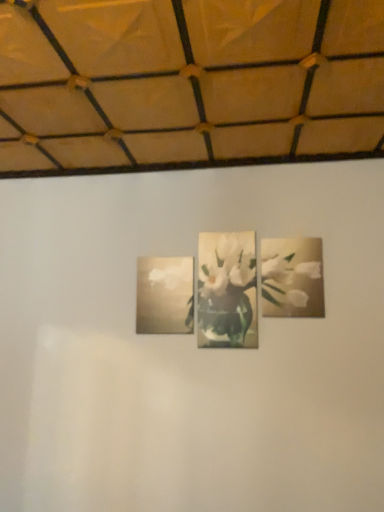
Locate an element on the screen. matte gold picture frame at center is located at coordinates (165, 295).

Describe the element at coordinates (165, 295) in the screenshot. I see `matte gold picture frame at center` at that location.

Image resolution: width=384 pixels, height=512 pixels. What are the coordinates of `white glossy flower at upper right` in the screenshot? It's located at (290, 281).

This screenshot has width=384, height=512. What do you see at coordinates (290, 281) in the screenshot?
I see `white glossy flower at upper right` at bounding box center [290, 281].

Locate an element on the screen. This screenshot has width=384, height=512. matte gold picture frame at center is located at coordinates (165, 295).

From the picture: Is matte gold picture frame at center to the left or to the right of white glossy flower at upper right in the image?

matte gold picture frame at center is positioned on white glossy flower at upper right's left side.

Looking at this image, is matte gold picture frame at center positioned before white glossy flower at upper right?

No.

Which is in front, point (188, 269) or point (271, 260)?

The point (271, 260) is in front.

From the image's perspective, is matte gold picture frame at center above or below white glossy flower at upper right?

Clearly, from the image's perspective, matte gold picture frame at center is below white glossy flower at upper right.

From a real-world perspective, is matte gold picture frame at center located beneath white glossy flower at upper right?

Yes, from a real-world perspective, matte gold picture frame at center is beneath white glossy flower at upper right.

Considering the relative sizes of matte gold picture frame at center and white glossy flower at upper right in the image provided, is matte gold picture frame at center wider than white glossy flower at upper right?

Yes, matte gold picture frame at center is wider than white glossy flower at upper right.

Which of these two, matte gold picture frame at center or white glossy flower at upper right, stands taller?

white glossy flower at upper right.

Does matte gold picture frame at center have a larger size compared to white glossy flower at upper right?

Yes, matte gold picture frame at center is bigger than white glossy flower at upper right.

Is matte gold picture frame at center inside or outside of white glossy flower at upper right?

matte gold picture frame at center exists outside the volume of white glossy flower at upper right.

Are matte gold picture frame at center and white glossy flower at upper right making contact?

matte gold picture frame at center and white glossy flower at upper right are clearly separated.

Is matte gold picture frame at center positioned with its back to white glossy flower at upper right?

That's not correct — matte gold picture frame at center is not looking away from white glossy flower at upper right.

How different are the orientations of matte gold picture frame at center and white glossy flower at upper right in degrees?

0.93 degrees.

Identify the location of flower that is on the right side of matte gold picture frame at center. This screenshot has width=384, height=512. (290, 281).

Considering the positions of objects white glossy flower at upper right and matte gold picture frame at center in the image provided, who is more to the left, white glossy flower at upper right or matte gold picture frame at center?

Positioned to the left is matte gold picture frame at center.

Considering the positions of objects white glossy flower at upper right and matte gold picture frame at center in the image provided, who is in front, white glossy flower at upper right or matte gold picture frame at center?

white glossy flower at upper right is closer to the camera.

Considering the positions of point (287, 309) and point (191, 278), is point (287, 309) closer or farther from the camera than point (191, 278)?

Point (287, 309).

From the image's perspective, is white glossy flower at upper right under matte gold picture frame at center?

No, from the image's perspective, white glossy flower at upper right is not below matte gold picture frame at center.

From a real-world perspective, is white glossy flower at upper right on top of matte gold picture frame at center?

Yes.

Does white glossy flower at upper right have a greater width compared to matte gold picture frame at center?

No.

Is white glossy flower at upper right shorter than matte gold picture frame at center?

Incorrect, the height of white glossy flower at upper right does not fall short of that of matte gold picture frame at center.

Considering the sizes of objects white glossy flower at upper right and matte gold picture frame at center in the image provided, who is bigger, white glossy flower at upper right or matte gold picture frame at center?

matte gold picture frame at center is bigger.

Is white glossy flower at upper right positioned beyond the bounds of matte gold picture frame at center?

That's correct, white glossy flower at upper right is outside of matte gold picture frame at center.

Is white glossy flower at upper right far away from matte gold picture frame at center?

No, white glossy flower at upper right is not far from matte gold picture frame at center.

Could you tell me if white glossy flower at upper right is facing matte gold picture frame at center?

No, white glossy flower at upper right is not oriented towards matte gold picture frame at center.

How many degrees apart are the facing directions of white glossy flower at upper right and matte gold picture frame at center?

0.93 degrees.

Where is `flower above the matte gold picture frame at center (from the image's perspective)`? This screenshot has width=384, height=512. flower above the matte gold picture frame at center (from the image's perspective) is located at coordinates (290, 281).

This screenshot has width=384, height=512. In order to click on picture frame on the left of white glossy flower at upper right in this screenshot , I will do `click(165, 295)`.

Image resolution: width=384 pixels, height=512 pixels. I want to click on flower in front of the matte gold picture frame at center, so click(x=290, y=281).